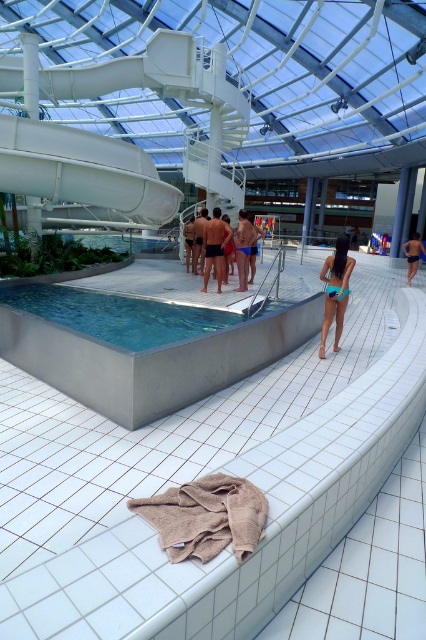
Is point (221, 236) positioned after point (419, 250)?

No, it is in front of (419, 250).

Which of these two, dark blue swimsuit at center or dark blue shorts at center, stands taller?

dark blue shorts at center

Which is in front, point (215, 227) or point (416, 269)?

Point (215, 227) is in front.

This screenshot has width=426, height=640. I want to click on dark blue swimsuit at center, so click(x=215, y=246).

How distant is smooth blue skin at center from matte black swim trunks at center?

The distance of smooth blue skin at center from matte black swim trunks at center is 4.34 meters.

Does point (239, 220) lie in front of point (192, 264)?

Yes, it is in front of point (192, 264).

Consider the image. Who is more forward, (253, 232) or (189, 234)?

Point (253, 232) is in front.

I want to click on smooth blue skin at center, so click(242, 248).

Who is higher up, teal fabric bikini at center or dark blue shorts at center?

dark blue shorts at center is higher up.

Based on the photo, who is more distant from viewer, (350, 272) or (414, 259)?

Positioned behind is point (414, 259).

I want to click on teal fabric bikini at center, so click(336, 291).